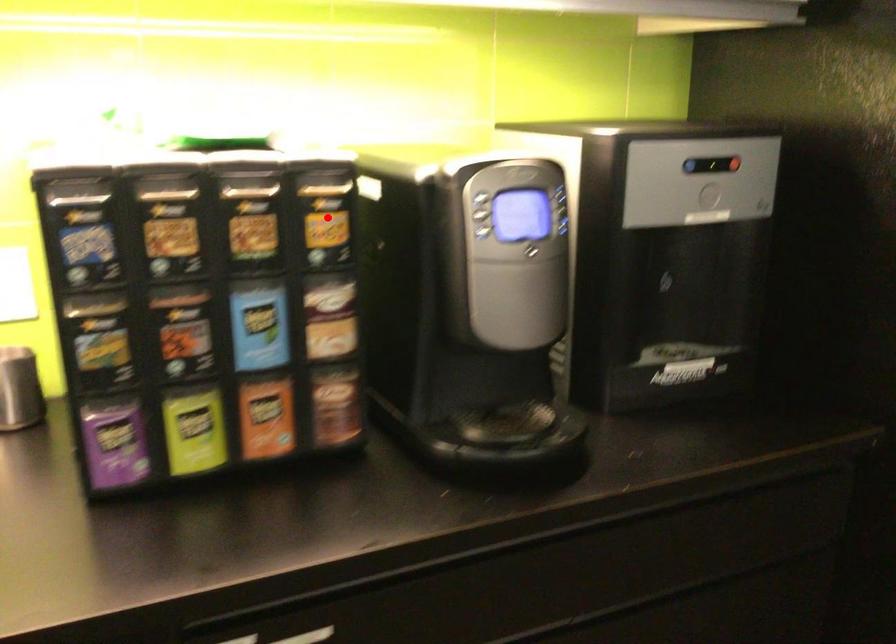
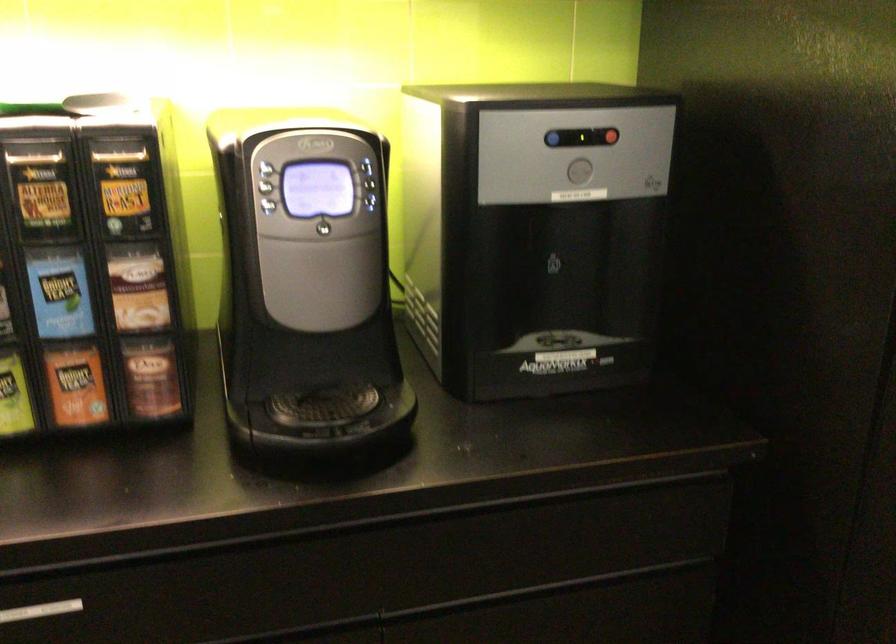
Find the pixel in the second image that matches the highlighted location in the first image.

(125, 185)